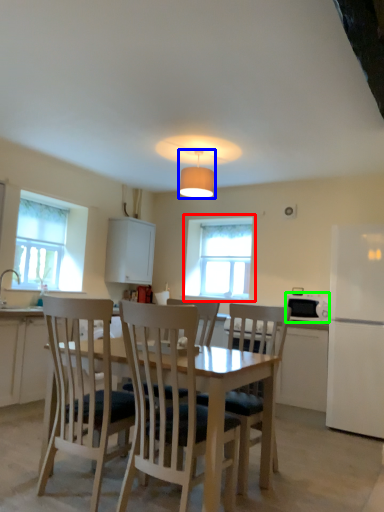
Question: Which object is positioned farthest from window (highlighted by a red box)? Select from lamp (highlighted by a blue box) and appliance (highlighted by a green box).

Choices:
 (A) lamp
 (B) appliance

Answer: (B)